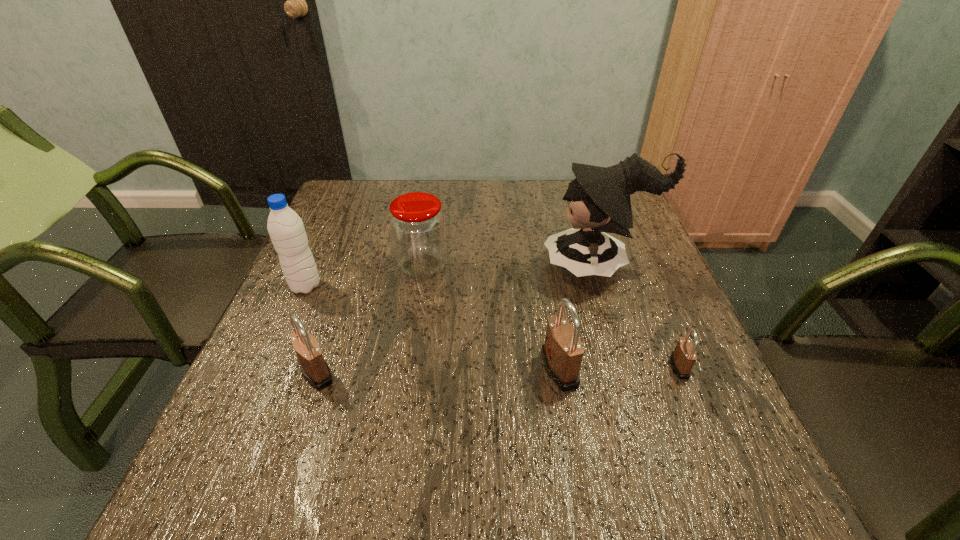
The image size is (960, 540). Find the location of `the fifth tallest object`. the fifth tallest object is located at coordinates (315, 370).

Identify the location of the second tallest padlock. The image size is (960, 540). (315, 370).

I want to click on the second padlock from left to right, so click(562, 353).

This screenshot has height=540, width=960. I want to click on the shortest object, so click(683, 358).

I want to click on the shortest padlock, so click(683, 358).

Locate an element on the screen. This screenshot has height=540, width=960. the tallest object is located at coordinates [x=598, y=198].

The image size is (960, 540). I want to click on jar, so click(x=417, y=225).

Find the location of `the leftmost object`. the leftmost object is located at coordinates (285, 227).

Locate an element on the screen. Image resolution: width=960 pixels, height=540 pixels. water bottle is located at coordinates (x=285, y=227).

This screenshot has height=540, width=960. I want to click on vacant area situated on the left of the fifth tallest object, so click(254, 373).